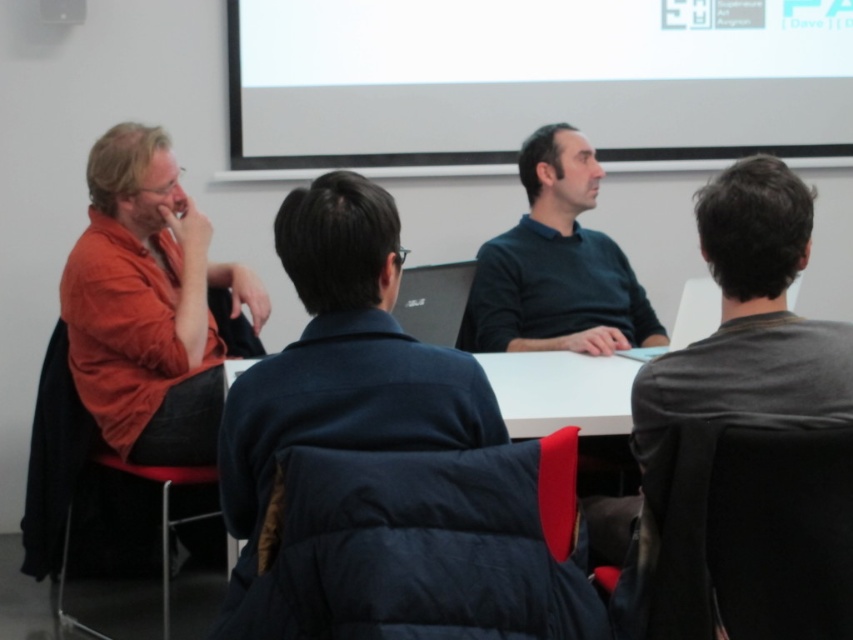
Does dark gray sweater at center appear under white matte table at center?

No, dark gray sweater at center is not below white matte table at center.

Is dark gray sweater at center positioned in front of white matte table at center?

That is True.

You are a GUI agent. You are given a task and a screenshot of the screen. Output one action in this format:
    pyautogui.click(x=<x>, y=<y>)
    Task: Click on the dark gray sweater at center
    The width and height of the screenshot is (853, 640).
    Given the screenshot: What is the action you would take?
    pyautogui.click(x=749, y=317)

Does dark blue puffer jacket at center have a lesser width compared to dark blue sweater at center?

Indeed, dark blue puffer jacket at center has a lesser width compared to dark blue sweater at center.

Which of these two, dark blue puffer jacket at center or dark blue sweater at center, stands taller?

dark blue sweater at center

Measure the distance between dark blue puffer jacket at center and camera.

dark blue puffer jacket at center and camera are 4.39 feet apart from each other.

Where is `dark blue puffer jacket at center`? This screenshot has height=640, width=853. dark blue puffer jacket at center is located at coordinates (343, 358).

Is the position of dark blue sweater at center less distant than that of white matte table at center?

No, it is behind white matte table at center.

Is point (590, 280) in front of point (502, 387)?

That is False.

The image size is (853, 640). Identify the location of dark blue sweater at center. (556, 266).

The image size is (853, 640). I want to click on dark blue sweater at center, so click(x=556, y=266).